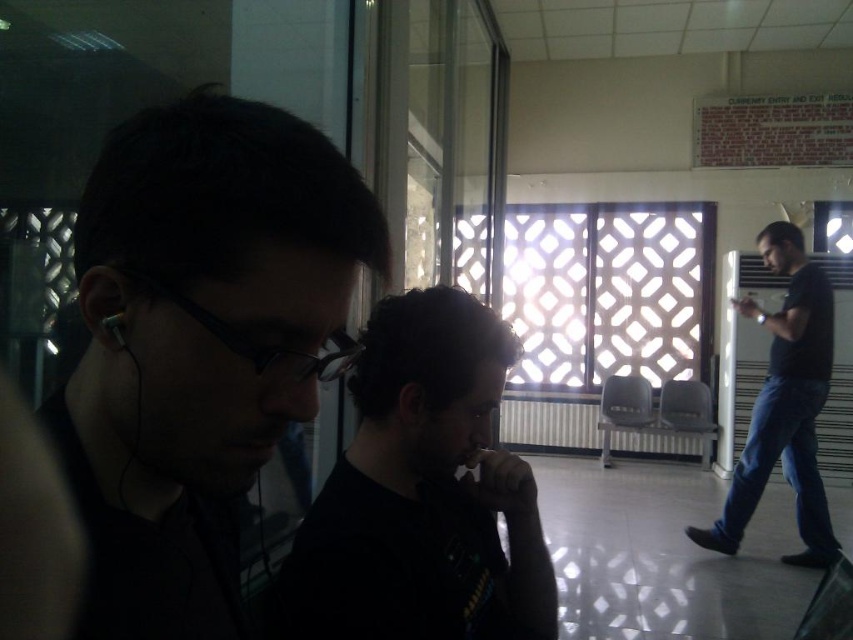
You are standing in the modern building scene and want to move from the point at coordinates point (433, 556) to the point at coordinates point (113, 342). Which direction should you move to get closer to the second point?

To move from point (433, 556) to point (113, 342), you should move downward and to the left because the second point is located lower and to the left of the first point in the coordinate system.

You are standing in the scene and want to move from the point closer to the camera to the point further away. Which path should you take between the two points, point (115, 550) and point (801, 381)?

You should move from point (115, 550) to point (801, 381) because point (115, 550) is closer to the camera and the other is further away.

You are organizing a clothing donation drive and need to categorize shirts by size. You have two shirts to assess in the image described. The first is the black matte shirt at center, and the second is the black matte shirt at right. Based on their visual appearance in the scene, which shirt would you estimate to be larger?

The black matte shirt at right is larger because its width is greater than the black matte shirt at center.